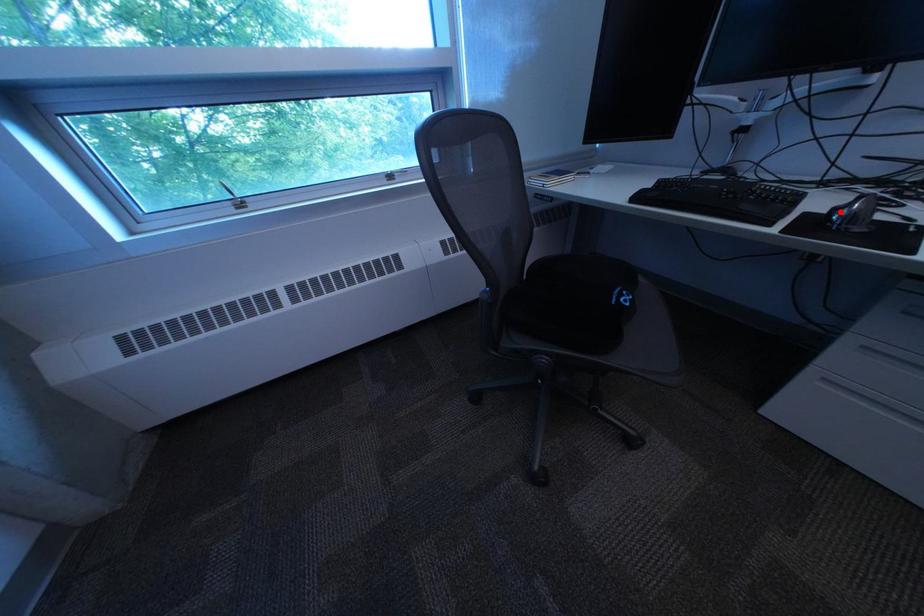
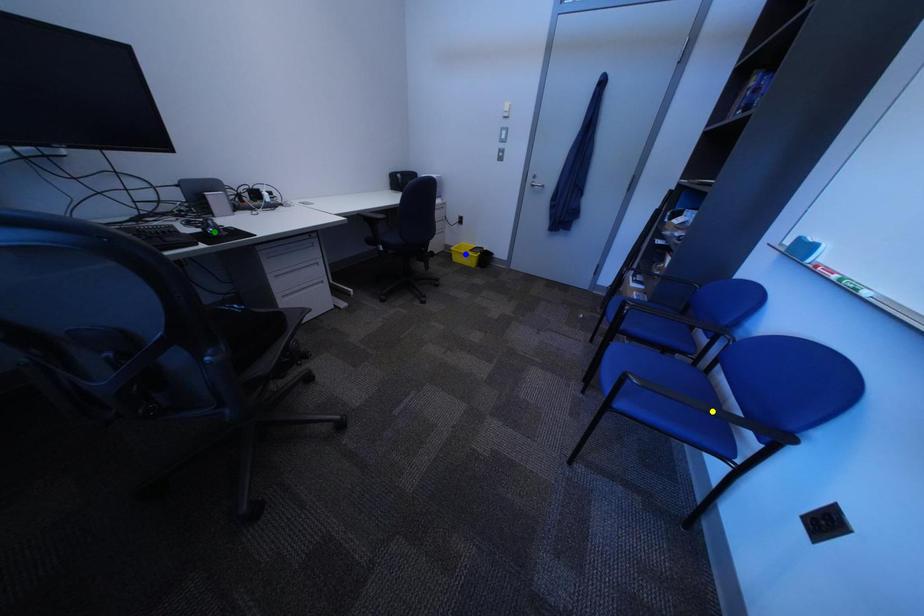
Question: I am providing you with two images of the same scene from different viewpoints. A red point is marked on the first image. You are given multiple points on the second image. Which point in image 2 represents the same 3d spot as the red point in image 1?

Choices:
 (A) green point
 (B) yellow point
 (C) blue point

Answer: (A)